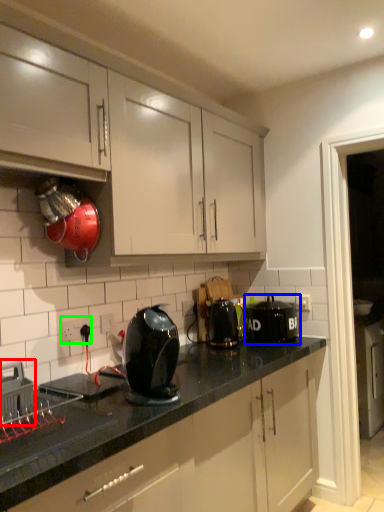
Question: Estimate the real-world distances between objects in this image. Which object is closer to home appliance (highlighted by a red box), kitchen appliance (highlighted by a blue box) or electric outlet (highlighted by a green box)?

Choices:
 (A) kitchen appliance
 (B) electric outlet

Answer: (B)